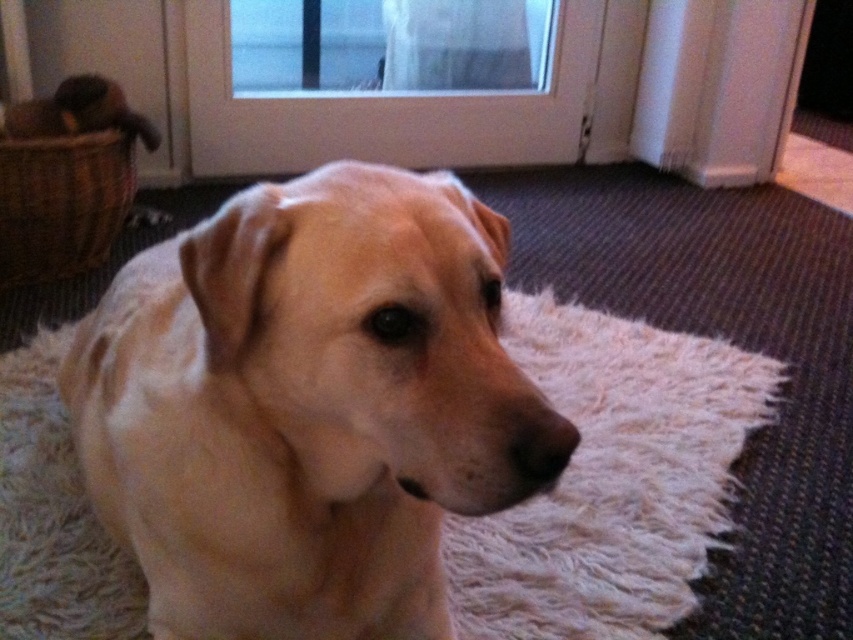
You are a delivery person trying to place a small package in the area near the white glass screen door at upper center. Is the woven brown basket at left blocking your access to that area?

The woven brown basket at left is behind the white glass screen door at upper center, so it is not blocking access to the area near the door. You can place the package there without any obstruction.

You are a delivery person trying to enter the house through the white glass screen door at upper center. There is a woven brown basket at left nearby. To reach the door, should you move to your right or left side?

The white glass screen door at upper center is positioned on the right side of the woven brown basket at left, so you should move to your right to reach the door.

You are a delivery person trying to see through the transparent glass door at upper center to check if the package is delivered correctly. However, there is a woven brown basket at left blocking your view. Can you see through the door without moving the basket?

The transparent glass door at upper center is shorter than the woven brown basket at left, so the basket is taller and might block the view. Therefore, you cannot see through the door without moving the basket.